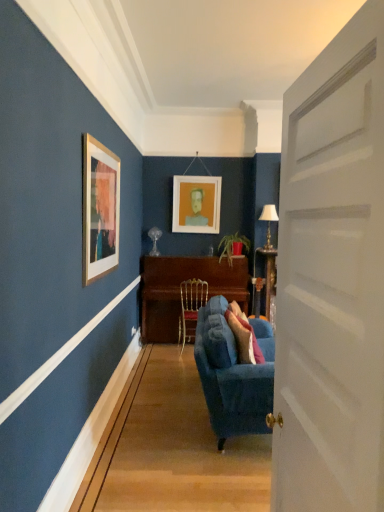
Question: Is white fabric lampshade at right closer to camera compared to white matte picture frame at center?

Choices:
 (A) yes
 (B) no

Answer: (A)

Question: Would you say white fabric lampshade at right is outside white matte picture frame at center?

Choices:
 (A) no
 (B) yes

Answer: (B)

Question: Does white fabric lampshade at right have a lesser width compared to white matte picture frame at center?

Choices:
 (A) no
 (B) yes

Answer: (A)

Question: From the image's perspective, is white fabric lampshade at right below white matte picture frame at center?

Choices:
 (A) yes
 (B) no

Answer: (A)

Question: Is the surface of white fabric lampshade at right in direct contact with white matte picture frame at center?

Choices:
 (A) yes
 (B) no

Answer: (B)

Question: Considering the relative positions of velvet blue couch at center and white matte picture frame at center in the image provided, is velvet blue couch at center to the left or to the right of white matte picture frame at center?

Choices:
 (A) left
 (B) right

Answer: (B)

Question: Which is correct: velvet blue couch at center is inside white matte picture frame at center, or outside of it?

Choices:
 (A) outside
 (B) inside

Answer: (A)

Question: From a real-world perspective, is velvet blue couch at center positioned above or below white matte picture frame at center?

Choices:
 (A) above
 (B) below

Answer: (B)

Question: Relative to white matte picture frame at center, is velvet blue couch at center in front or behind?

Choices:
 (A) behind
 (B) front

Answer: (B)

Question: From the image's perspective, relative to wooden piano at center, is white matte door at center above or below?

Choices:
 (A) above
 (B) below

Answer: (A)

Question: Considering the positions of point (286, 449) and point (167, 273), is point (286, 449) closer or farther from the camera than point (167, 273)?

Choices:
 (A) closer
 (B) farther

Answer: (A)

Question: From a real-world perspective, is white matte door at center positioned above or below wooden piano at center?

Choices:
 (A) above
 (B) below

Answer: (A)

Question: Considering the positions of white matte door at center and wooden piano at center in the image, is white matte door at center bigger or smaller than wooden piano at center?

Choices:
 (A) small
 (B) big

Answer: (A)

Question: Is gold metallic chair at center to the left or to the right of white matte picture frame at center in the image?

Choices:
 (A) left
 (B) right

Answer: (A)

Question: Does point (180, 291) appear closer or farther from the camera than point (192, 202)?

Choices:
 (A) farther
 (B) closer

Answer: (B)